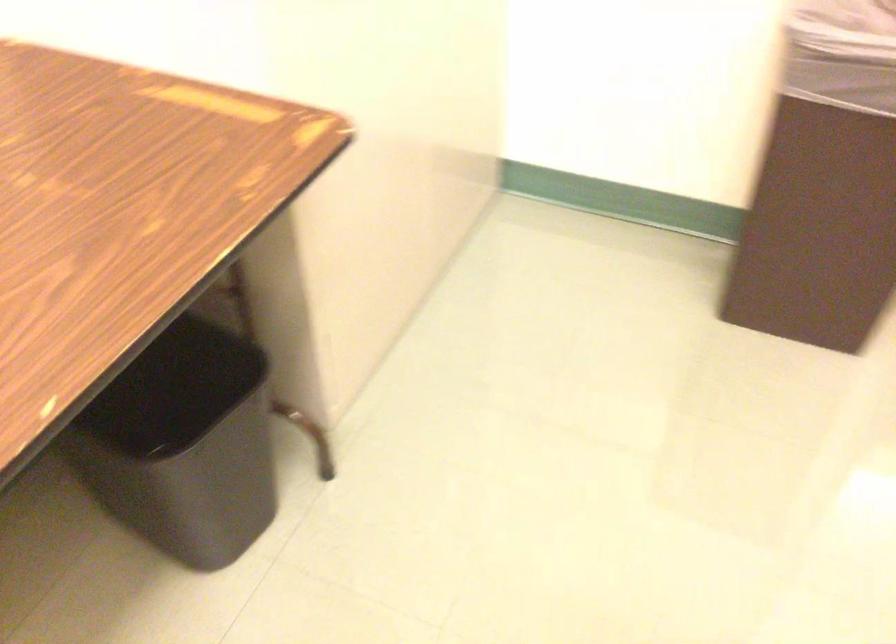
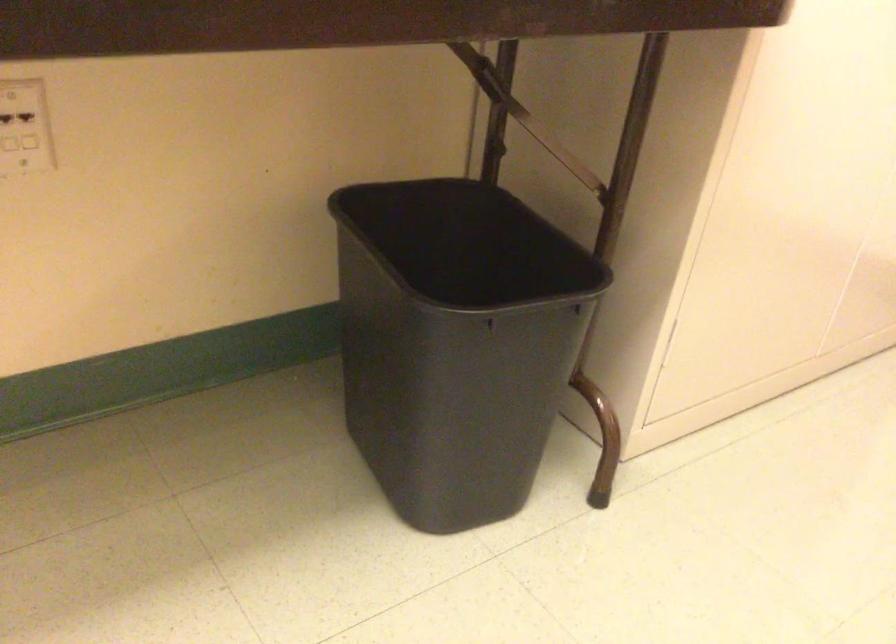
Question: The first image is from the beginning of the video and the second image is from the end. How did the camera likely rotate when shooting the video?

Choices:
 (A) Left
 (B) Right
 (C) Up
 (D) Down

Answer: (A)